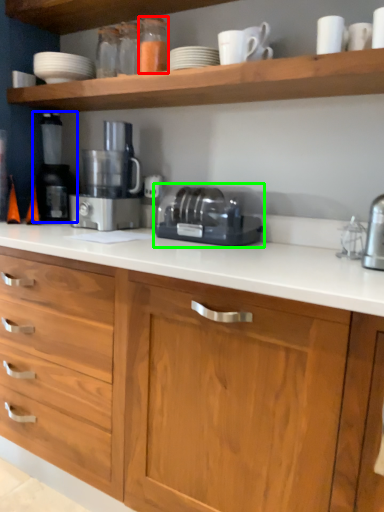
Question: Based on their relative distances, which object is nearer to bottle (highlighted by a red box)? Choose from coffee machine (highlighted by a blue box) and toaster (highlighted by a green box).

Choices:
 (A) coffee machine
 (B) toaster

Answer: (B)